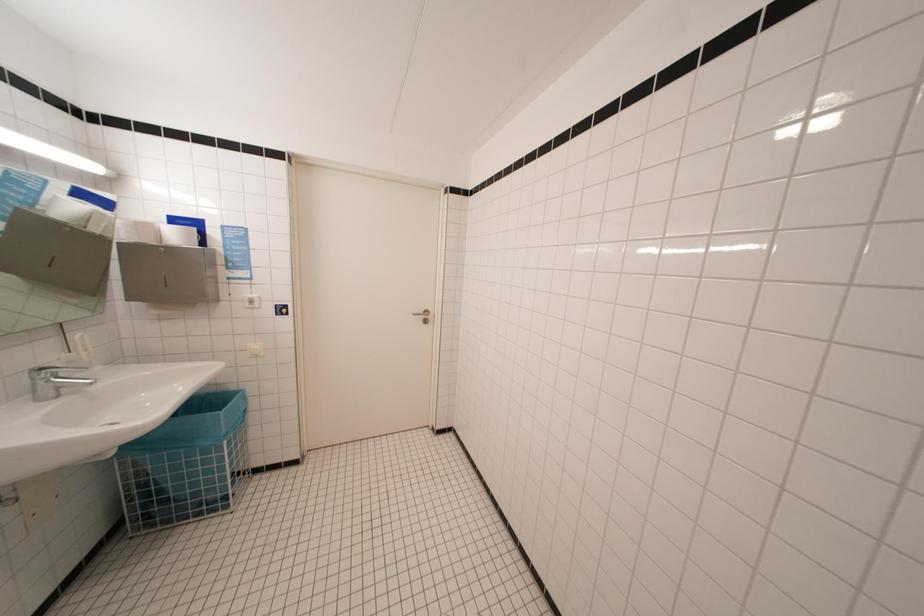
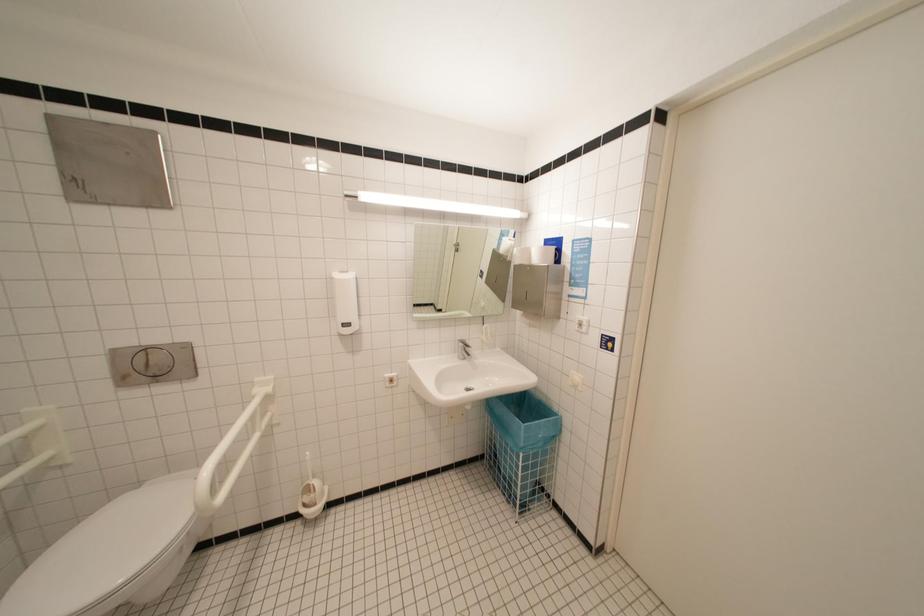
Question: The images are taken continuously from a first-person perspective. In which direction is your viewpoint rotating?

Choices:
 (A) Left
 (B) Right
 (C) Up
 (D) Down

Answer: (A)